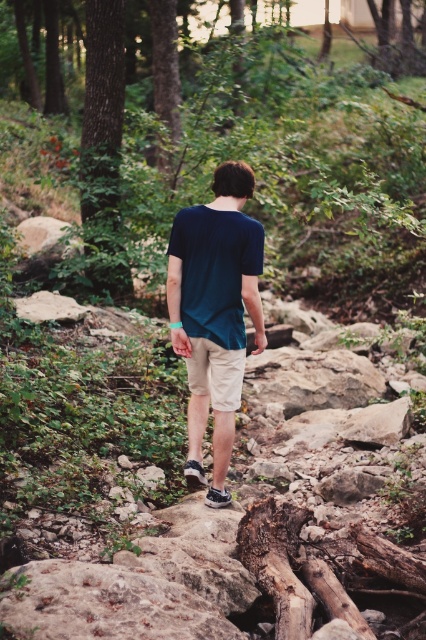
Based on the scene description, can you determine which clothing item, the dark blue cotton shirt at center or the khaki cotton shorts at center, has a bigger size?

The dark blue cotton shirt at center is larger in size than the khaki cotton shorts at center.

You are standing at the camera position and want to throw a small stone to hit the dark blue cotton shirt at center. If the maximum distance you can throw is 4.5 meters, will you be able to reach it?

The dark blue cotton shirt at center is 5.00 meters away from the camera. Since your maximum throwing distance is 4.5 meters, you cannot reach it.